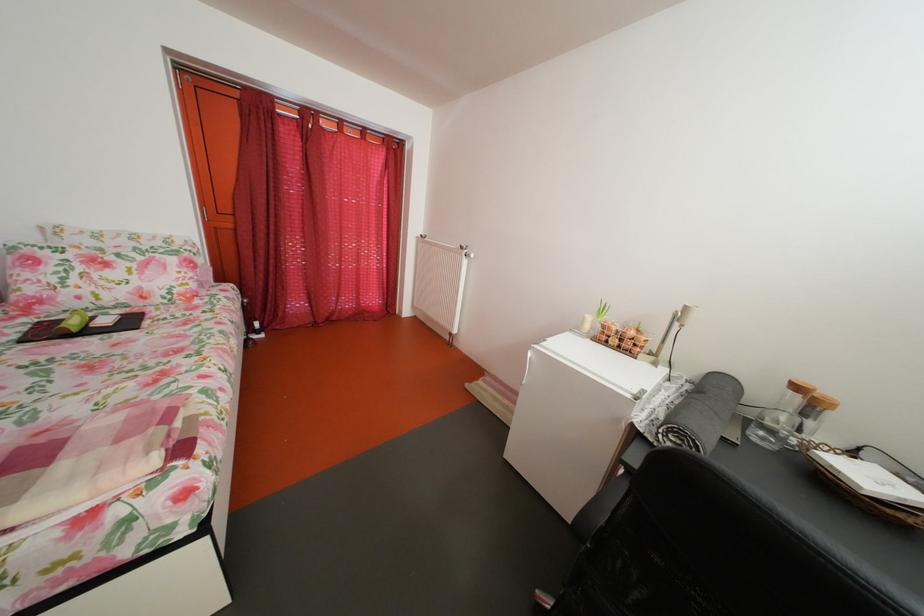
Image resolution: width=924 pixels, height=616 pixels. I want to click on green lotion tube, so click(73, 322).